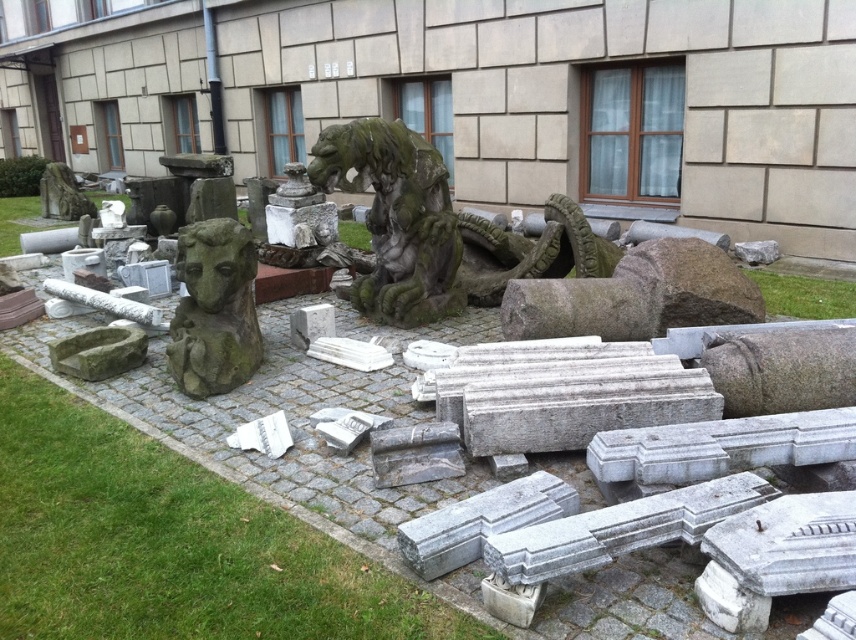
Question: Does green grass at center have a smaller size compared to green mossy stone dragon at center?

Choices:
 (A) no
 (B) yes

Answer: (A)

Question: Estimate the real-world distances between objects in this image. Which object is closer to the green mossy stone at center?

Choices:
 (A) green grass at lower left
 (B) green mossy stone bust at left

Answer: (B)

Question: Can you confirm if green grass at lower left is positioned to the left of green grass at lower right?

Choices:
 (A) no
 (B) yes

Answer: (B)

Question: Considering the real-world distances, which object is farthest from the green grass at center?

Choices:
 (A) green grass at lower right
 (B) green mossy stone dragon at center
 (C) green mossy stone at center

Answer: (C)

Question: Which point is farther to the camera?

Choices:
 (A) (57, 182)
 (B) (16, 204)

Answer: (B)

Question: Where is green mossy stone dragon at center located in relation to green mossy stone at center in the image?

Choices:
 (A) right
 (B) left

Answer: (A)